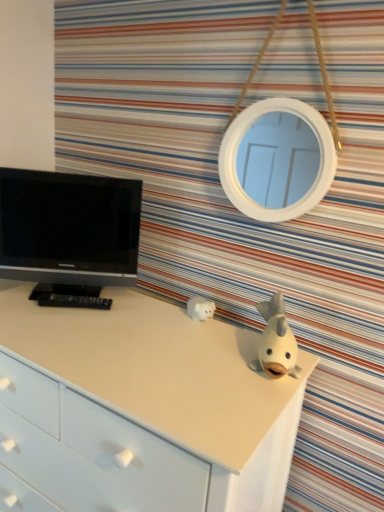
Locate an element on the screen. This screenshot has height=512, width=384. white matte piggy bank at center, positioned as the second toy in front-to-back order is located at coordinates (200, 308).

You are a GUI agent. You are given a task and a screenshot of the screen. Output one action in this format:
    pyautogui.click(x=<x>, y=<y>)
    Task: Click on the black glossy tv at left
    
    Given the screenshot: What is the action you would take?
    [69, 229]

Is black glossy tv at left far away from white matte piggy bank at center, which is counted as the first toy, starting from the left?

No, black glossy tv at left is not far from white matte piggy bank at center, which is counted as the first toy, starting from the left.

Which is further, (4, 263) or (187, 307)?

Point (4, 263)

From the image's perspective, is black glossy tv at left above white matte piggy bank at center, the second toy from the right?

Indeed, from the image's perspective, black glossy tv at left is shown above white matte piggy bank at center, the second toy from the right.

Does black glossy tv at left lie behind white matte piggy bank at center, the second toy from the right?

No.

Is the position of white matte chest of drawers at center less distant than that of white matte piggy bank at center, the second toy from the right?

Yes, white matte chest of drawers at center is closer to the viewer.

Is white matte chest of drawers at center next to white matte piggy bank at center, the first toy from the back?

white matte chest of drawers at center and white matte piggy bank at center, the first toy from the back, are clearly separated.

Can you confirm if white matte chest of drawers at center is thinner than white matte piggy bank at center, the second toy from the right?

No.

Considering the positions of objects white matte chest of drawers at center and white matte piggy bank at center, positioned as the second toy in front-to-back order, in the image provided, who is more to the right, white matte chest of drawers at center or white matte piggy bank at center, positioned as the second toy in front-to-back order,?

Positioned to the right is white matte piggy bank at center, positioned as the second toy in front-to-back order.

Considering the relative sizes of white matte chest of drawers at center and white matte fish at upper right, the 2th toy from the back, in the image provided, is white matte chest of drawers at center wider than white matte fish at upper right, the 2th toy from the back,?

Indeed, white matte chest of drawers at center has a greater width compared to white matte fish at upper right, the 2th toy from the back.

From the image's perspective, relative to white matte fish at upper right, the 2th toy from the back, is white matte chest of drawers at center above or below?

white matte chest of drawers at center is below white matte fish at upper right, the 2th toy from the back.

How many degrees apart are the facing directions of white matte chest of drawers at center and white matte fish at upper right, the 2th toy from the back?

The angle between the facing direction of white matte chest of drawers at center and the facing direction of white matte fish at upper right, the 2th toy from the back, is 21.4 degrees.

From the image's perspective, is black glossy tv at left under white matte chest of drawers at center?

No.

Considering the positions of objects black glossy tv at left and white matte chest of drawers at center in the image provided, who is more to the left, black glossy tv at left or white matte chest of drawers at center?

black glossy tv at left is more to the left.

Considering the sizes of objects black glossy tv at left and white matte chest of drawers at center in the image provided, who is taller, black glossy tv at left or white matte chest of drawers at center?

Standing taller between the two is white matte chest of drawers at center.

Is white matte chest of drawers at center thinner than black glossy tv at left?

No.

Can we say white matte chest of drawers at center lies outside black glossy tv at left?

That's correct, white matte chest of drawers at center is outside of black glossy tv at left.

Is white matte chest of drawers at center closer to camera compared to black glossy tv at left?

Yes, white matte chest of drawers at center is closer to the viewer.

From the picture: Which of these two, white matte fish at upper right, the 2th toy viewed from the left, or white matte piggy bank at center, the first toy from the back, is smaller?

white matte piggy bank at center, the first toy from the back, is smaller.

Is white matte fish at upper right, placed as the 1th toy when sorted from right to left, turned away from white matte piggy bank at center, the first toy from the back?

No, white matte fish at upper right, placed as the 1th toy when sorted from right to left, is not facing the opposite direction of white matte piggy bank at center, the first toy from the back.

Are white matte fish at upper right, placed as the 1th toy when sorted from right to left, and white matte piggy bank at center, the first toy from the back, far apart?

Actually, white matte fish at upper right, placed as the 1th toy when sorted from right to left, and white matte piggy bank at center, the first toy from the back, are a little close together.

Which object is positioned more to the right, white matte fish at upper right, the 2th toy from the back, or black glossy tv at left?

From the viewer's perspective, white matte fish at upper right, the 2th toy from the back, appears more on the right side.

Does point (295, 374) come farther from viewer compared to point (9, 243)?

No, it is in front of (9, 243).

From a real-world perspective, is white matte fish at upper right, the 2th toy viewed from the left, below black glossy tv at left?

Correct, in the physical world, white matte fish at upper right, the 2th toy viewed from the left, is lower than black glossy tv at left.

Which object is closer to the camera, white matte fish at upper right, placed as the 1th toy when sorted from right to left, or black glossy tv at left?

white matte fish at upper right, placed as the 1th toy when sorted from right to left, is more forward.

Where is `television on the left of the white matte piggy bank at center, the first toy from the back`? This screenshot has width=384, height=512. television on the left of the white matte piggy bank at center, the first toy from the back is located at coordinates (69, 229).

Locate an element on the screen. the chest of drawers that is below the white matte piggy bank at center, which is counted as the first toy, starting from the left (from the image's perspective) is located at coordinates (139, 410).

Based on their spatial positions, is white matte chest of drawers at center or white matte fish at upper right, placed as the 1th toy when sorted from right to left, closer to white matte piggy bank at center, positioned as the second toy in front-to-back order?

white matte fish at upper right, placed as the 1th toy when sorted from right to left, lies closer to white matte piggy bank at center, positioned as the second toy in front-to-back order, than the other object.

Based on their spatial positions, is white matte chest of drawers at center or black glossy tv at left closer to white matte fish at upper right, the 2th toy viewed from the left?

white matte chest of drawers at center.

Considering their positions, is white matte fish at upper right, arranged as the first toy when viewed from the front, positioned closer to white matte piggy bank at center, the first toy from the back, than white matte chest of drawers at center?

white matte fish at upper right, arranged as the first toy when viewed from the front.

Based on their spatial positions, is white matte fish at upper right, the 2th toy from the back, or white matte piggy bank at center, the first toy from the back, further from white matte chest of drawers at center?

The object further to white matte chest of drawers at center is white matte piggy bank at center, the first toy from the back.

Considering their positions, is white matte piggy bank at center, the second toy from the right, positioned further to white matte chest of drawers at center than black glossy tv at left?

white matte piggy bank at center, the second toy from the right, lies further to white matte chest of drawers at center than the other object.

From the image, which object appears to be farther from white matte fish at upper right, arranged as the first toy when viewed from the front, black glossy tv at left or white matte piggy bank at center, positioned as the second toy in front-to-back order?

black glossy tv at left lies further to white matte fish at upper right, arranged as the first toy when viewed from the front, than the other object.

When comparing their distances from black glossy tv at left, does white matte piggy bank at center, the second toy from the right, or white matte chest of drawers at center seem further?

Based on the image, white matte piggy bank at center, the second toy from the right, appears to be further to black glossy tv at left.

Looking at the image, which one is located further to white matte chest of drawers at center, black glossy tv at left or white matte piggy bank at center, which is counted as the first toy, starting from the left?

Based on the image, white matte piggy bank at center, which is counted as the first toy, starting from the left, appears to be further to white matte chest of drawers at center.

The width and height of the screenshot is (384, 512). I want to click on toy between white matte piggy bank at center, which is counted as the first toy, starting from the left, and white matte chest of drawers at center vertically, so click(276, 341).

Where is `toy between black glossy tv at left and white matte fish at upper right, the 2th toy from the back, in the horizontal direction`? This screenshot has width=384, height=512. toy between black glossy tv at left and white matte fish at upper right, the 2th toy from the back, in the horizontal direction is located at coordinates (200, 308).